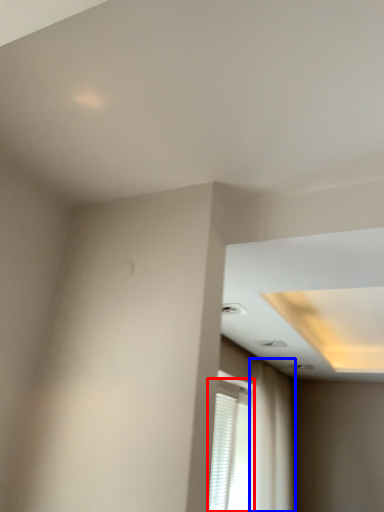
Question: Which object appears closest to the camera in this image, window (highlighted by a red box) or curtain (highlighted by a blue box)?

Choices:
 (A) window
 (B) curtain

Answer: (A)